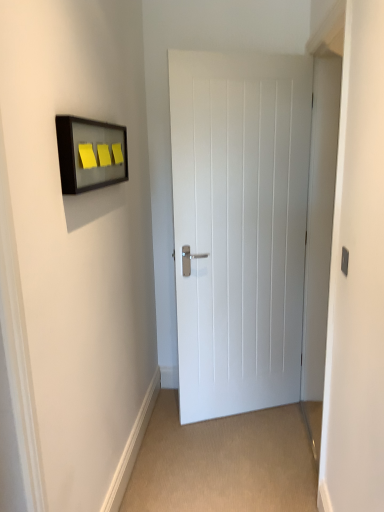
Question: Based on their positions, is white painted wood door at center located to the left or right of matte glass frame at upper left?

Choices:
 (A) left
 (B) right

Answer: (B)

Question: In terms of size, does white painted wood door at center appear bigger or smaller than matte glass frame at upper left?

Choices:
 (A) small
 (B) big

Answer: (B)

Question: Estimate the real-world distances between objects in this image. Which object is closer to the white painted wood door at center?

Choices:
 (A) matte gray switch at right
 (B) matte glass frame at upper left

Answer: (B)

Question: Which object is positioned farthest from the matte glass frame at upper left?

Choices:
 (A) white painted wood door at center
 (B) matte gray switch at right

Answer: (B)